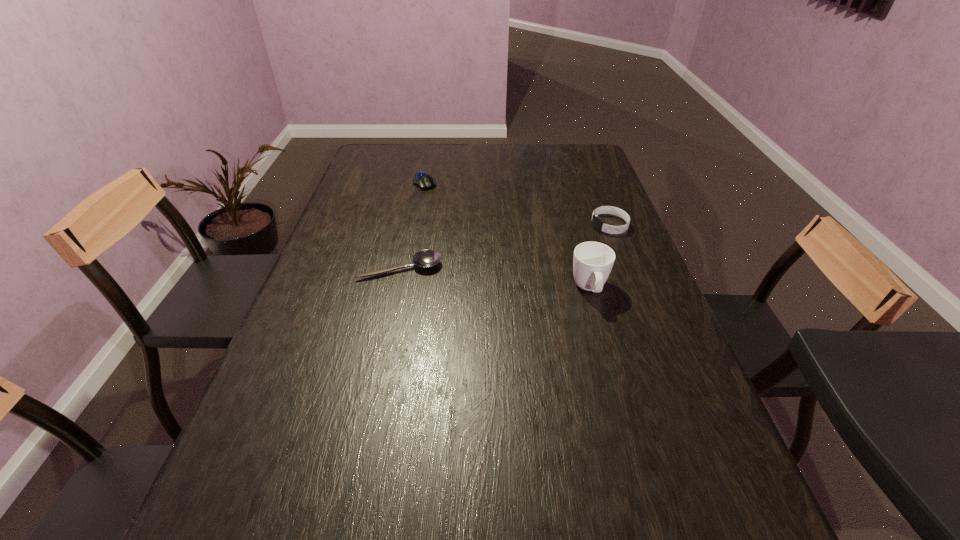
Where is `vacant space at the left edge of the desktop`? vacant space at the left edge of the desktop is located at coordinates (324, 276).

Find the location of a particular element. This screenshot has width=960, height=540. free spot at the right edge of the desktop is located at coordinates (677, 408).

Find the location of `free region at the far right corner of the desktop`. free region at the far right corner of the desktop is located at coordinates (595, 154).

The height and width of the screenshot is (540, 960). Identify the location of free spot between the ladle and the rightmost object. (505, 246).

Image resolution: width=960 pixels, height=540 pixels. In order to click on empty location between the computer mouse and the ladle in this screenshot , I will do `click(413, 225)`.

Where is `vacant space that is in between the ladle and the rightmost object`? This screenshot has height=540, width=960. vacant space that is in between the ladle and the rightmost object is located at coordinates (505, 246).

Locate an element on the screen. This screenshot has width=960, height=540. vacant region between the ladle and the farthest object is located at coordinates (413, 225).

Find the location of a particular element. unoccupied area between the tallest object and the ladle is located at coordinates (495, 279).

In order to click on empty location between the third shortest object and the shortest object in this screenshot , I will do `click(505, 246)`.

Find the location of a particular element. The height and width of the screenshot is (540, 960). unoccupied position between the third object from left to right and the second shortest object is located at coordinates (507, 236).